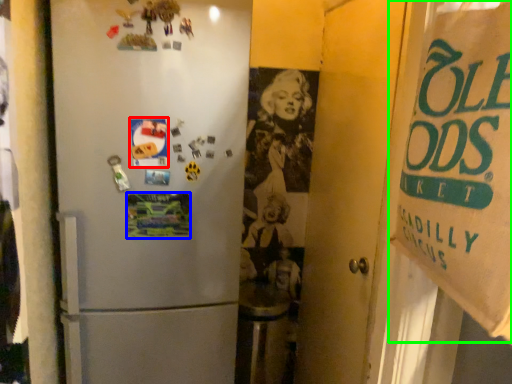
Question: Which is nearer to the postcard (highlighted by a red box)? postcard (highlighted by a blue box) or poster (highlighted by a green box).

Choices:
 (A) postcard
 (B) poster

Answer: (A)